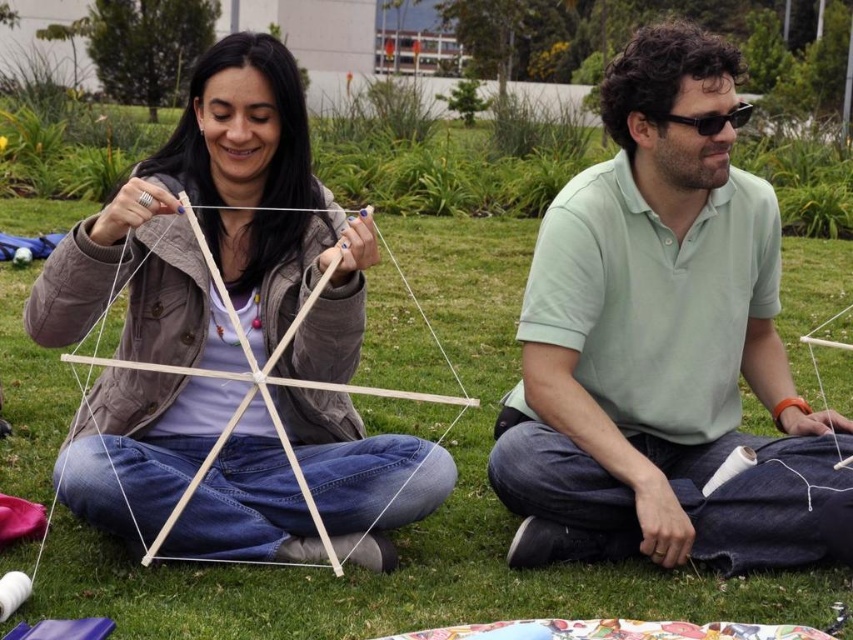
Can you confirm if light green cotton shirt at center is wider than white matte string at center?

No, light green cotton shirt at center is not wider than white matte string at center.

Can you confirm if light green cotton shirt at center is taller than white matte string at center?

Yes, light green cotton shirt at center is taller than white matte string at center.

Looking at this image, who is more forward, (x=660, y=461) or (x=281, y=435)?

Point (x=281, y=435) is in front.

Locate an element on the screen. This screenshot has height=640, width=853. light green cotton shirt at center is located at coordinates (660, 342).

Who is positioned more to the left, green grass at center or black plastic goggles at upper right?

Positioned to the left is green grass at center.

Is green grass at center positioned at the back of black plastic goggles at upper right?

No, green grass at center is in front of black plastic goggles at upper right.

Which is in front, point (827, 356) or point (715, 132)?

Positioned in front is point (715, 132).

The height and width of the screenshot is (640, 853). I want to click on green grass at center, so click(x=422, y=522).

Is light green cotton shirt at center behind green grass at center?

Yes.

Who is more distant from viewer, (775, 241) or (468, 522)?

The point (468, 522) is behind.

The width and height of the screenshot is (853, 640). I want to click on light green cotton shirt at center, so click(660, 342).